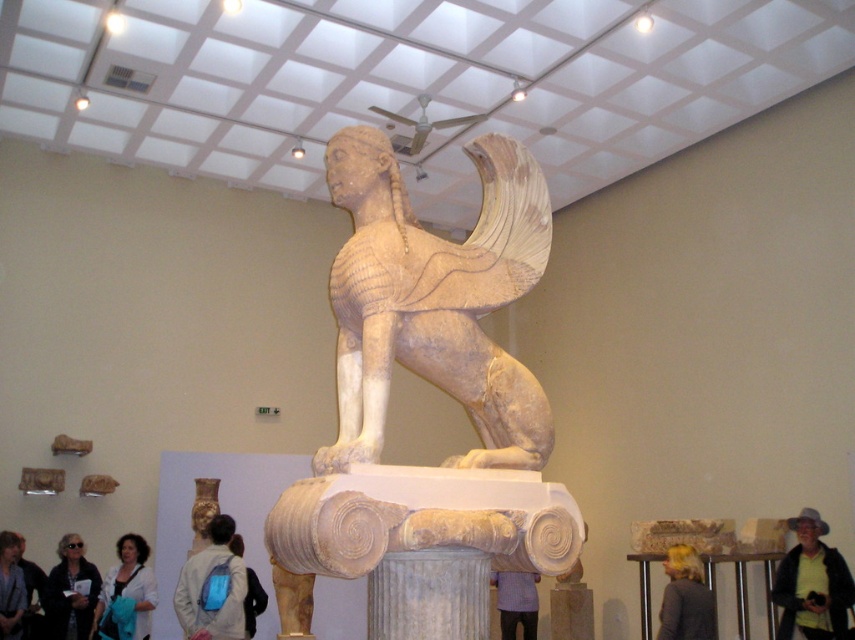
Which is more to the left, matte white shirt at lower left or purple fabric shirt at center?

matte white shirt at lower left is more to the left.

Is matte white shirt at lower left above purple fabric shirt at center?

Yes, matte white shirt at lower left is above purple fabric shirt at center.

Between point (110, 616) and point (531, 624), which one is positioned in front?

Point (110, 616) is more forward.

Where is `matte white shirt at lower left`? The image size is (855, 640). matte white shirt at lower left is located at coordinates (127, 593).

Which is below, matte white jacket at lower left or purple fabric shirt at center?

Positioned lower is purple fabric shirt at center.

Looking at this image, does matte white jacket at lower left have a greater height compared to purple fabric shirt at center?

No.

Image resolution: width=855 pixels, height=640 pixels. In order to click on matte white jacket at lower left in this screenshot , I will do `click(71, 592)`.

The height and width of the screenshot is (640, 855). Identify the location of matte white jacket at lower left. (71, 592).

From the picture: Who is lower down, yellow-green shirt at center or blonde hair at lower right?

blonde hair at lower right

Is point (812, 636) positioned in front of point (693, 564)?

Yes, it is in front of point (693, 564).

Identify the location of yellow-green shirt at center. (812, 582).

You are a GUI agent. You are given a task and a screenshot of the screen. Output one action in this format:
    pyautogui.click(x=<x>, y=<y>)
    Task: Click on the yellow-green shirt at center
    
    Given the screenshot: What is the action you would take?
    pyautogui.click(x=812, y=582)